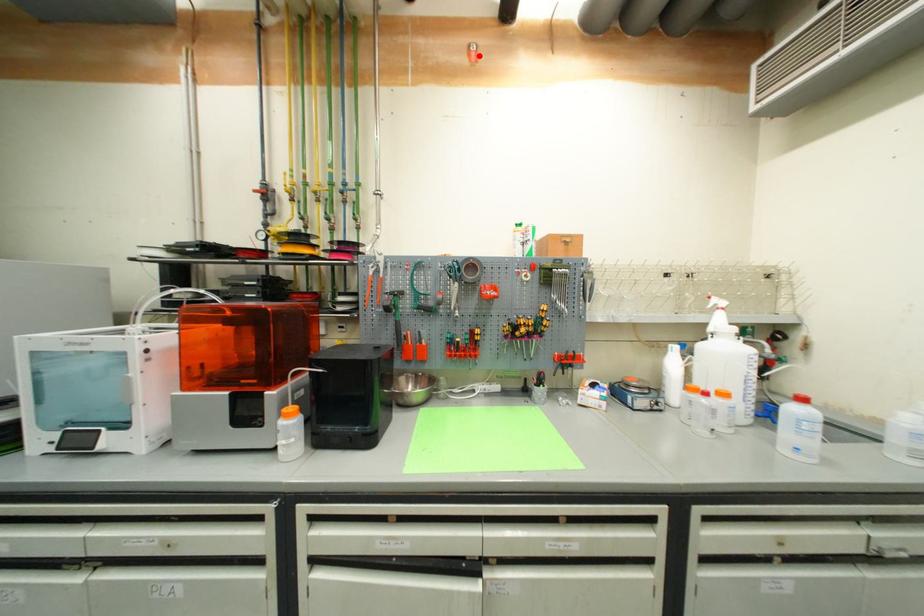
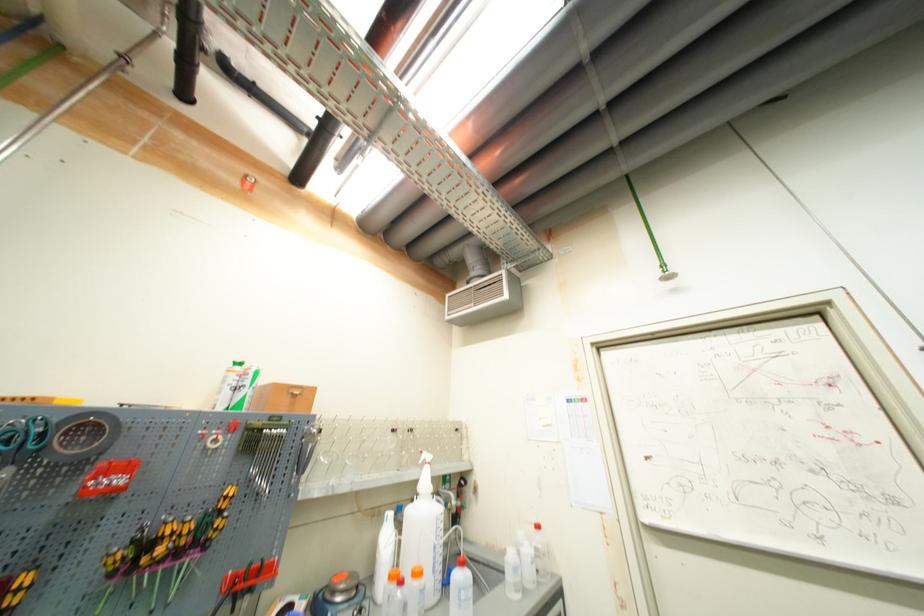
Where in the second image is the point corresponding to the highlighted location from the first image?

(253, 185)